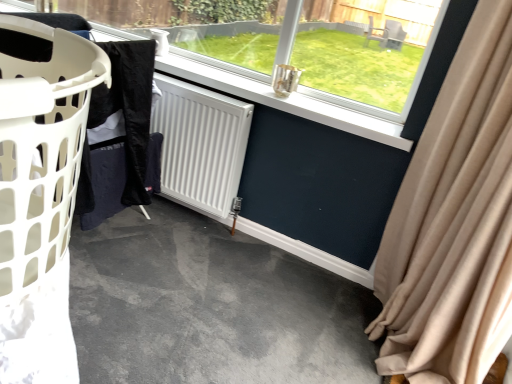
Question: From the image's perspective, is transparent glass window at center on white plastic laundry basket at left?

Choices:
 (A) yes
 (B) no

Answer: (A)

Question: Is white plastic laundry basket at left at the back of transparent glass window at center?

Choices:
 (A) yes
 (B) no

Answer: (B)

Question: From a real-world perspective, is transparent glass window at center physically above white plastic laundry basket at left?

Choices:
 (A) no
 (B) yes

Answer: (A)

Question: Is transparent glass window at center closer to camera compared to white plastic laundry basket at left?

Choices:
 (A) no
 (B) yes

Answer: (A)

Question: Is white plastic laundry basket at left surrounded by transparent glass window at center?

Choices:
 (A) yes
 (B) no

Answer: (B)

Question: Can you confirm if transparent glass window at center is positioned to the right of white plastic laundry basket at left?

Choices:
 (A) no
 (B) yes

Answer: (A)

Question: Is white plastic laundry basket at left inside white matte radiator at center?

Choices:
 (A) no
 (B) yes

Answer: (A)

Question: Is white matte radiator at center further to camera compared to white plastic laundry basket at left?

Choices:
 (A) no
 (B) yes

Answer: (B)

Question: Is white matte radiator at center not inside white plastic laundry basket at left?

Choices:
 (A) no
 (B) yes

Answer: (B)

Question: From a real-world perspective, is white matte radiator at center on white plastic laundry basket at left?

Choices:
 (A) yes
 (B) no

Answer: (B)

Question: Is white matte radiator at center positioned in front of white plastic laundry basket at left?

Choices:
 (A) no
 (B) yes

Answer: (A)

Question: Considering the relative sizes of white matte radiator at center and white plastic laundry basket at left in the image provided, is white matte radiator at center bigger than white plastic laundry basket at left?

Choices:
 (A) no
 (B) yes

Answer: (A)

Question: Does beige fabric curtain at right contain black fabric at left?

Choices:
 (A) yes
 (B) no

Answer: (B)